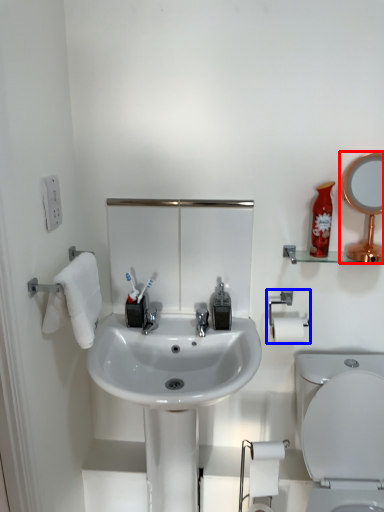
Question: Which point is closer to the camera, mirror (highlighted by a red box) or towel bar (highlighted by a blue box)?

Choices:
 (A) mirror
 (B) towel bar

Answer: (A)